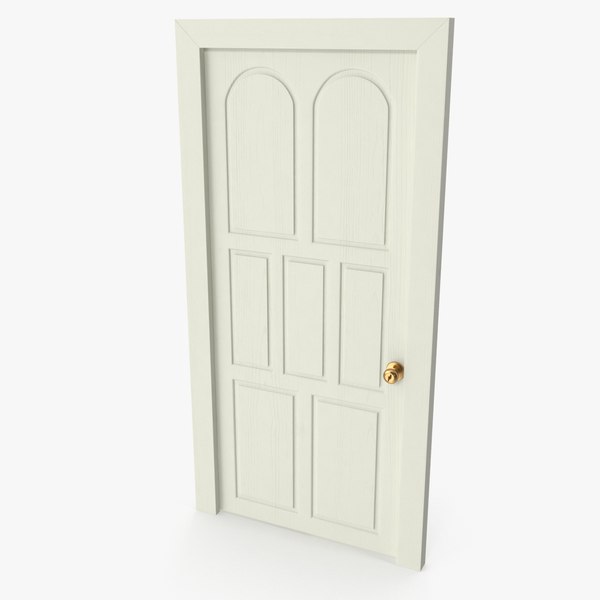
Where is `door knob`? This screenshot has height=600, width=600. door knob is located at coordinates (391, 375).